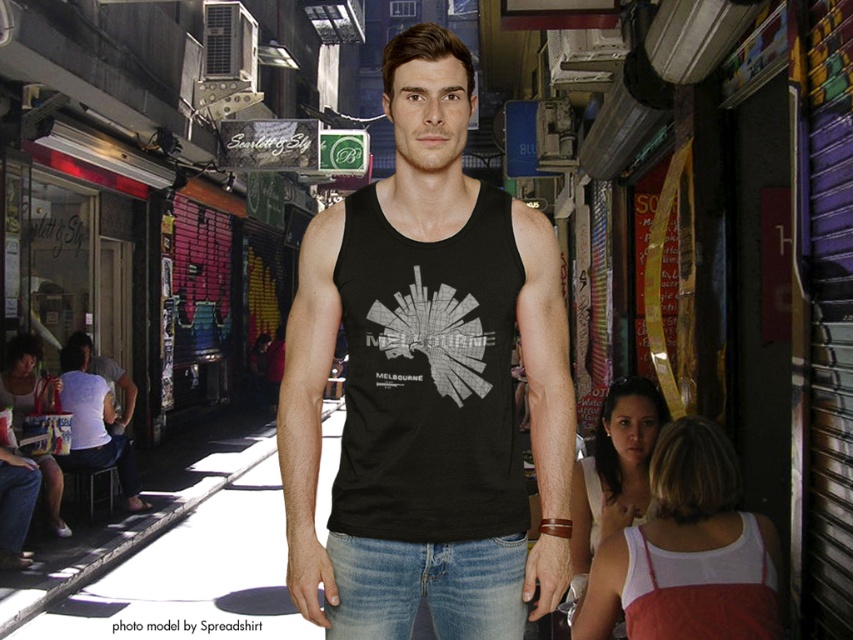
Question: Among these points, which one is nearest to the camera?

Choices:
 (A) pos(515,444)
 (B) pos(332,570)

Answer: (B)

Question: Does black matte tank top at center have a larger size compared to black heather tank top at center?

Choices:
 (A) yes
 (B) no

Answer: (A)

Question: Does black heather tank top at center have a larger size compared to denim at center?

Choices:
 (A) yes
 (B) no

Answer: (A)

Question: Which object is positioned farthest from the denim at center?

Choices:
 (A) black heather tank top at center
 (B) black matte tank top at center

Answer: (B)

Question: Which of the following is the farthest from the observer?

Choices:
 (A) (386, 600)
 (B) (492, 192)
 (C) (457, 324)

Answer: (B)

Question: Can you confirm if black heather tank top at center is positioned to the right of denim at center?

Choices:
 (A) yes
 (B) no

Answer: (A)